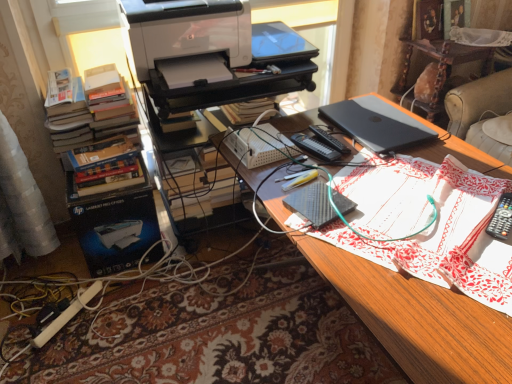
Locate an element on the screen. vacant space behind black textured notebook at center is located at coordinates (314, 176).